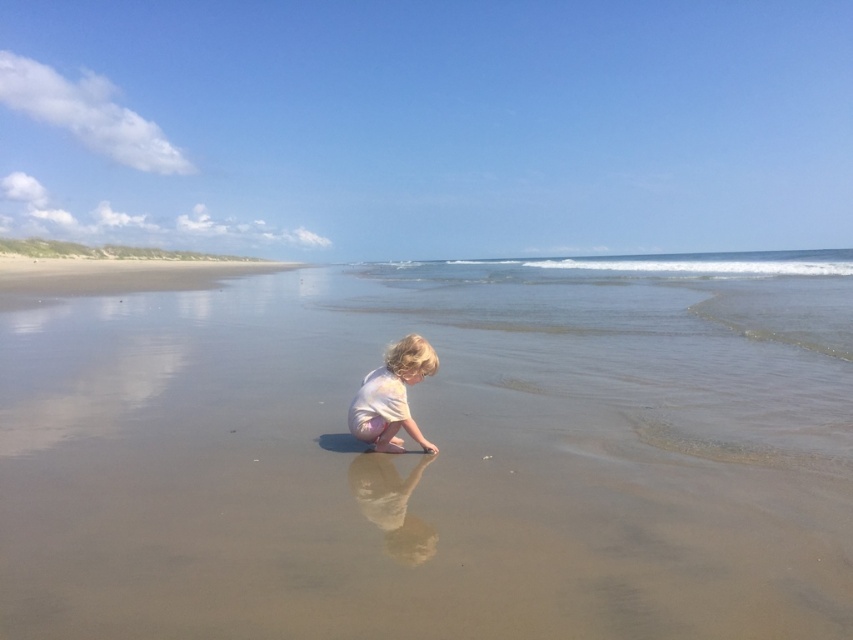
You are standing on the beach and want to find the smooth sand at center. According to the coordinates provided, where should you look relative to the horizon?

The smooth sand at center is located at point coordinates 0.711 on the x axis and 0.513 on the y axis, so you should look slightly to the right and just below the center of the image relative to the horizon.

You are standing on the beach and see two points marked in the sand. The first point is at coordinate point [669,554] and the second is at point [381,419]. Which point is closer to where you are standing?

Point [669,554] is closer to the viewer than point [381,419], so the first point is closer to where you are standing.